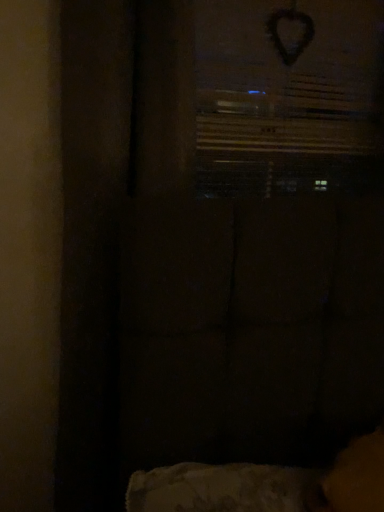
Image resolution: width=384 pixels, height=512 pixels. Describe the element at coordinates (266, 485) in the screenshot. I see `white textured bed at lower right` at that location.

You are a GUI agent. You are given a task and a screenshot of the screen. Output one action in this format:
    pyautogui.click(x=<x>, y=<y>)
    Task: Click on the white textured bed at lower right
    
    Given the screenshot: What is the action you would take?
    pyautogui.click(x=266, y=485)

Identify the location of white textured bed at lower right. (266, 485).